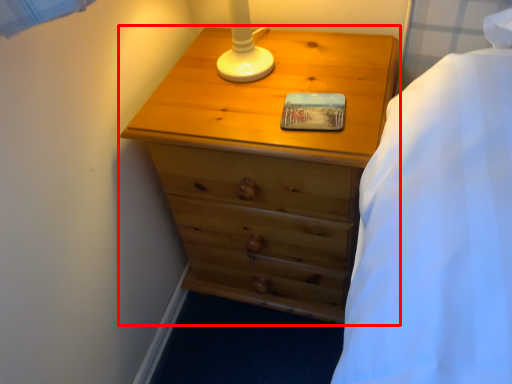
Question: Where is chest of drawers (annotated by the red box) located in relation to pad in the image?

Choices:
 (A) right
 (B) left

Answer: (B)